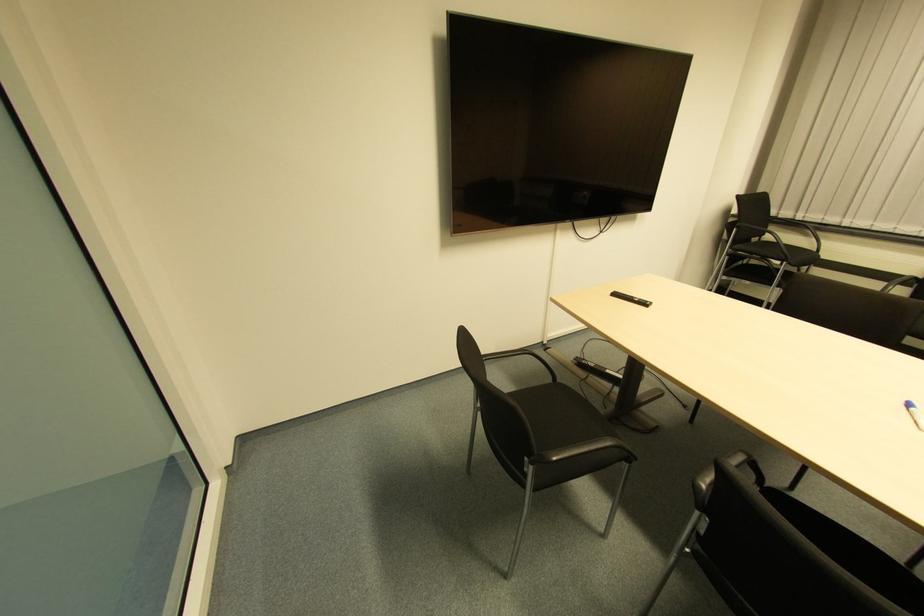
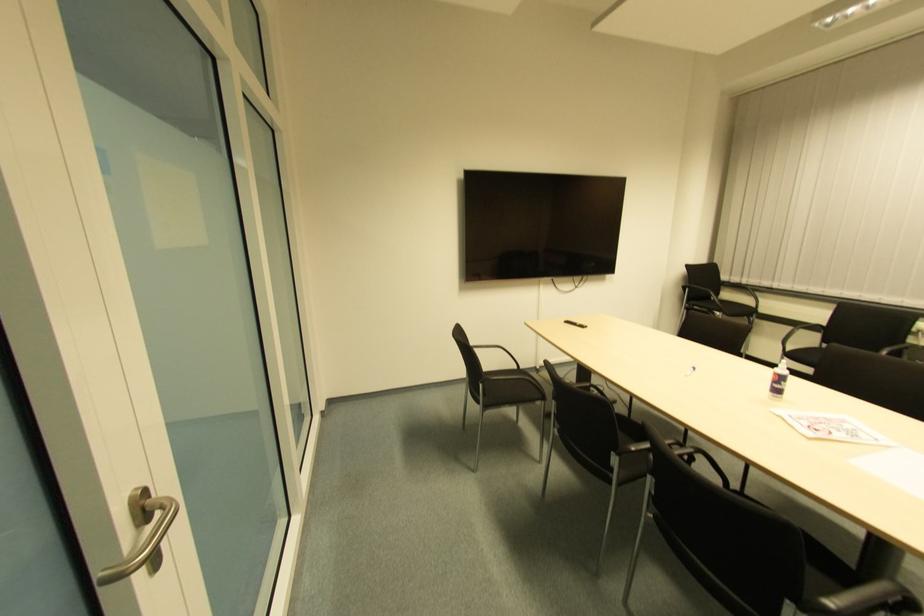
Where in the second image is the point corresponding to [636,299] from the first image?

(577, 325)